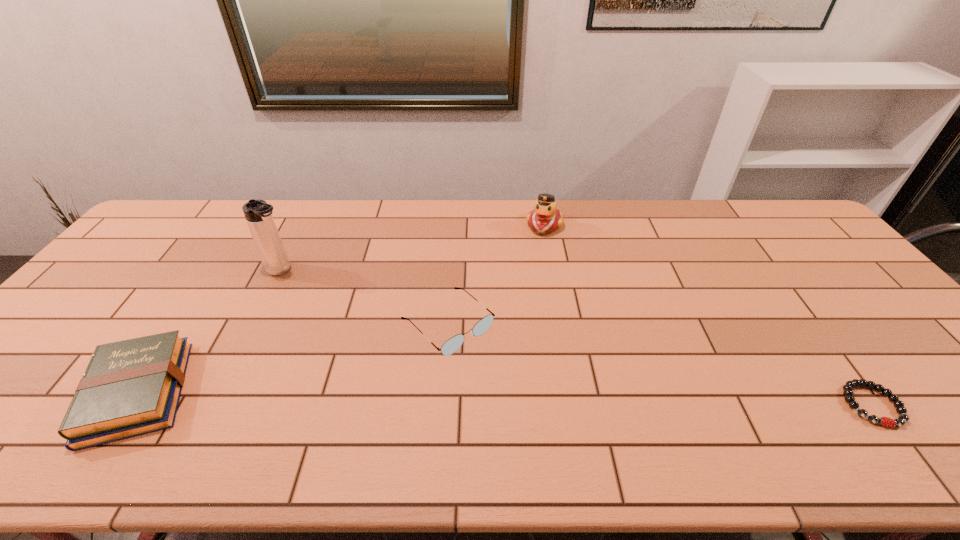
This screenshot has width=960, height=540. Find the location of `free space between the book and the shortest object`. free space between the book and the shortest object is located at coordinates (505, 399).

Where is `free spot between the bracelet and the second tallest object`? Image resolution: width=960 pixels, height=540 pixels. free spot between the bracelet and the second tallest object is located at coordinates (708, 315).

Locate an element on the screen. The image size is (960, 540). vacant space that's between the third object from left to right and the farthest object is located at coordinates pos(496,275).

I want to click on free space that is in between the rightmost object and the tallest object, so click(x=577, y=338).

I want to click on vacant space that is in between the rightmost object and the book, so click(x=505, y=399).

The image size is (960, 540). Identify the location of empty space between the tallest object and the duck. (414, 248).

The height and width of the screenshot is (540, 960). Find the location of `free spot between the second farthest object and the duck`. free spot between the second farthest object and the duck is located at coordinates (414, 248).

At what (x,y) coordinates should I click in order to perform the action: click on unoccupied position between the shortest object and the leftmost object. Please return your answer as a coordinate pair (x, y). This screenshot has width=960, height=540. Looking at the image, I should click on (505, 399).

The width and height of the screenshot is (960, 540). Identify the location of the third closest object to the book. (545, 217).

The width and height of the screenshot is (960, 540). Find the location of `the closest object to the book`. the closest object to the book is located at coordinates (258, 214).